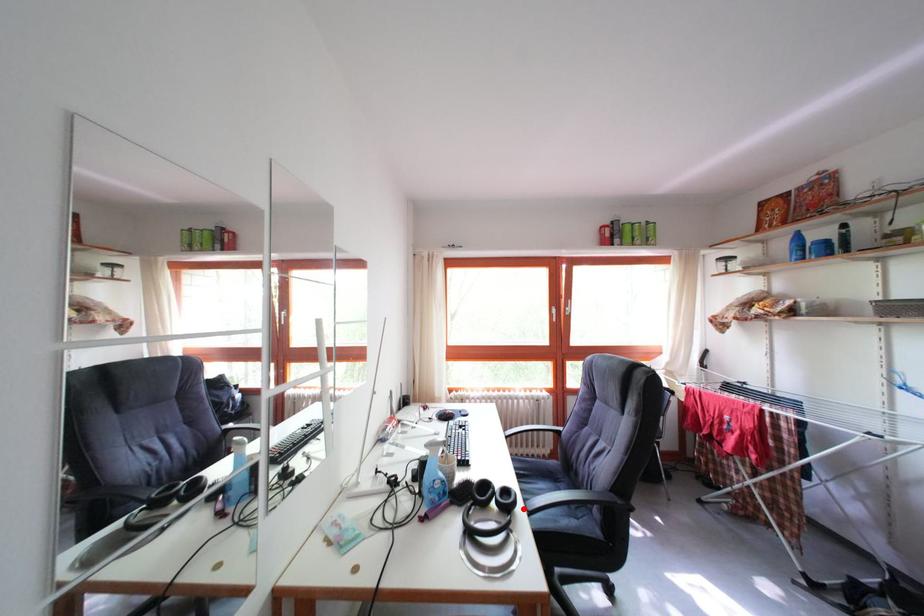
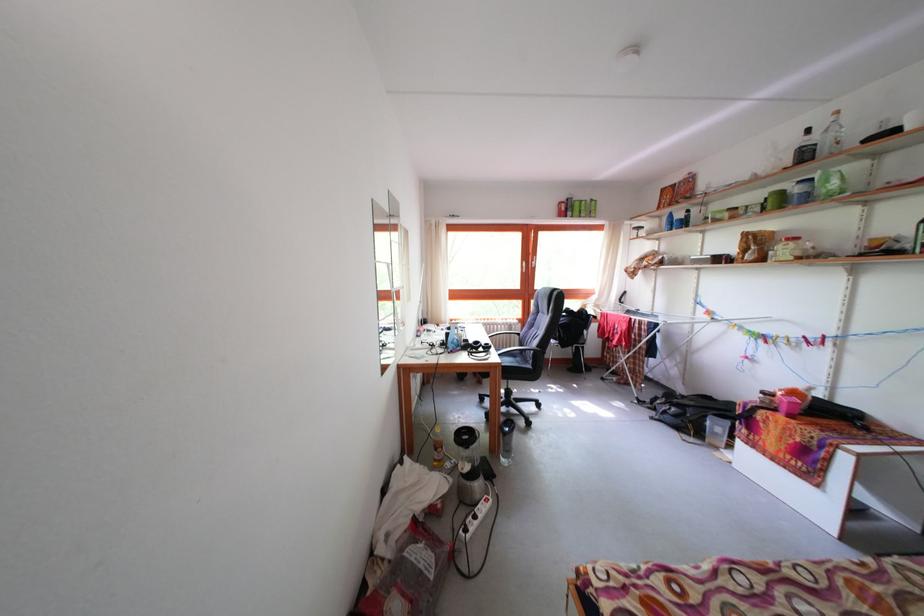
Where in the second image is the point corresponding to the highlighted location from the first image?

(499, 354)